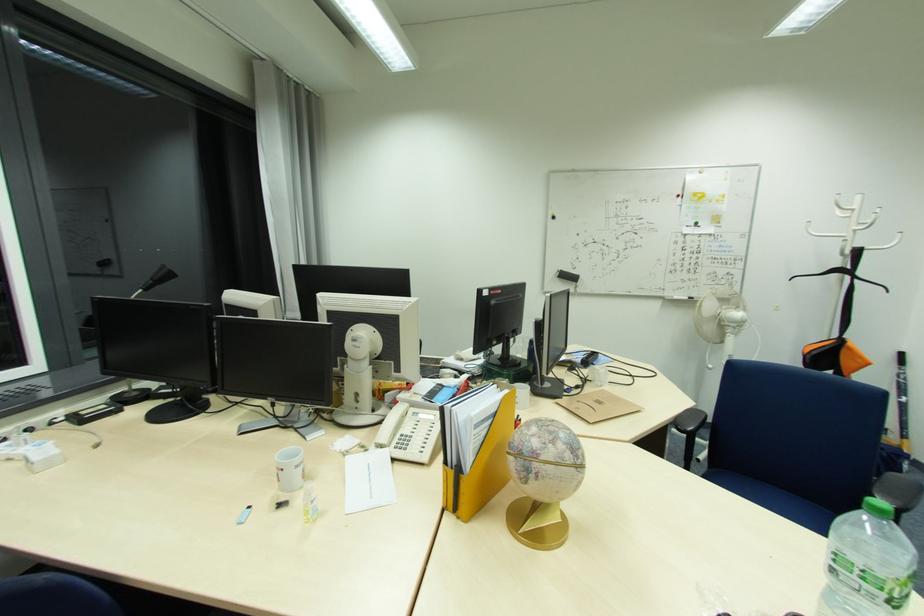
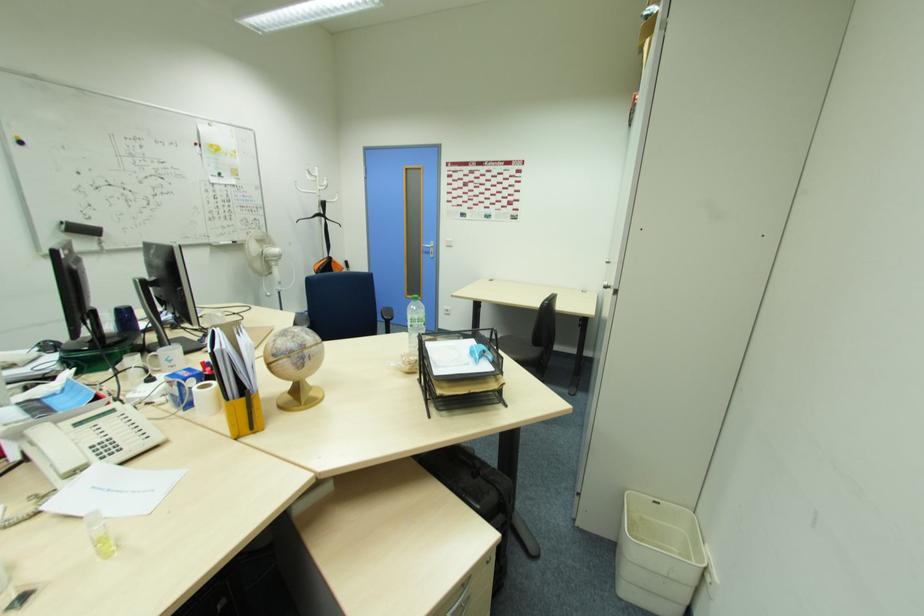
Find the pixel in the second image that matches [561,400] in the first image.

(209, 351)